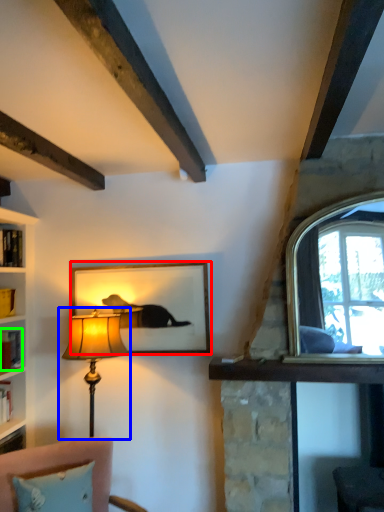
Question: Considering the real-world distances, which object is closest to picture frame (highlighted by a red box)? lamp (highlighted by a blue box) or book (highlighted by a green box).

Choices:
 (A) lamp
 (B) book

Answer: (A)